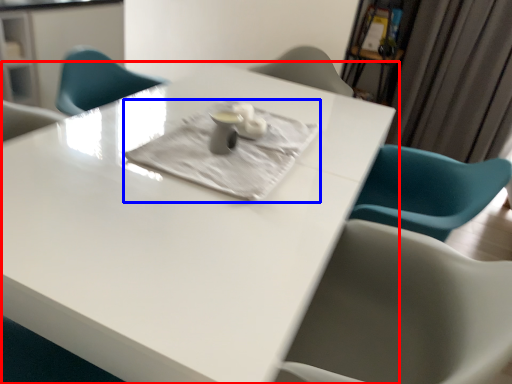
Question: Which object is further to the camera taking this photo, table (highlighted by a red box) or cloth (highlighted by a blue box)?

Choices:
 (A) table
 (B) cloth

Answer: (B)